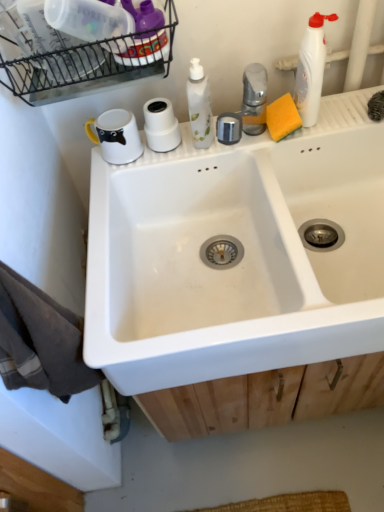
Question: From a real-world perspective, is black wire basket at upper left below white matte toilet paper at upper center?

Choices:
 (A) yes
 (B) no

Answer: (B)

Question: Can you confirm if black wire basket at upper left is taller than white matte toilet paper at upper center?

Choices:
 (A) yes
 (B) no

Answer: (A)

Question: From the image's perspective, would you say black wire basket at upper left is positioned over white matte toilet paper at upper center?

Choices:
 (A) no
 (B) yes

Answer: (B)

Question: Does black wire basket at upper left come behind white matte toilet paper at upper center?

Choices:
 (A) yes
 (B) no

Answer: (B)

Question: Is black wire basket at upper left aimed at white matte toilet paper at upper center?

Choices:
 (A) yes
 (B) no

Answer: (B)

Question: Is black wire basket at upper left to the left of white matte toilet paper at upper center from the viewer's perspective?

Choices:
 (A) no
 (B) yes

Answer: (B)

Question: Does yellow sponge at upper right turn towards white matte toilet paper at upper center?

Choices:
 (A) yes
 (B) no

Answer: (B)

Question: Is yellow sponge at upper right touching white matte toilet paper at upper center?

Choices:
 (A) no
 (B) yes

Answer: (A)

Question: Would you say white matte toilet paper at upper center is part of yellow sponge at upper right's contents?

Choices:
 (A) no
 (B) yes

Answer: (A)

Question: Is yellow sponge at upper right positioned with its back to white matte toilet paper at upper center?

Choices:
 (A) yes
 (B) no

Answer: (B)

Question: Is yellow sponge at upper right positioned behind white matte toilet paper at upper center?

Choices:
 (A) no
 (B) yes

Answer: (A)

Question: Considering the relative sizes of yellow sponge at upper right and white matte toilet paper at upper center in the image provided, is yellow sponge at upper right bigger than white matte toilet paper at upper center?

Choices:
 (A) no
 (B) yes

Answer: (B)

Question: Does white matte toilet paper at upper center have a greater height compared to black wire basket at upper left?

Choices:
 (A) no
 (B) yes

Answer: (A)